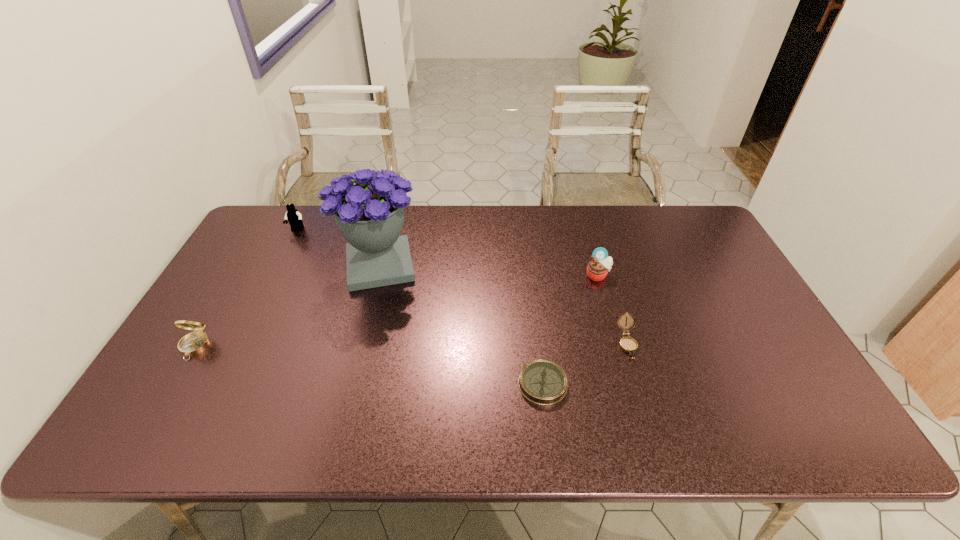
The height and width of the screenshot is (540, 960). I want to click on the third object from right to left, so click(543, 382).

Locate an element on the screen. free point located on the front of the bouquet is located at coordinates (365, 324).

Where is `free location located on the front-facing side of the second object from left to right`? This screenshot has height=540, width=960. free location located on the front-facing side of the second object from left to right is located at coordinates (255, 314).

Find the location of a particular element. vacant position located on the front-facing side of the muffin is located at coordinates (631, 390).

You are a GUI agent. You are given a task and a screenshot of the screen. Output one action in this format:
    pyautogui.click(x=<x>, y=<y>)
    Task: Click on the vacant space located 0.070m with the dial facing the leftmost compass
    This screenshot has height=540, width=960.
    Given the screenshot: What is the action you would take?
    pyautogui.click(x=172, y=384)

This screenshot has height=540, width=960. What are the coordinates of `free spot located on the face of the fifth tallest object` in the screenshot? It's located at (657, 440).

The height and width of the screenshot is (540, 960). Identify the location of vacant space located on the back of the nearest compass. (535, 319).

This screenshot has width=960, height=540. In order to click on bouquet at the far edge in this screenshot , I will do `click(370, 213)`.

Image resolution: width=960 pixels, height=540 pixels. Find the location of `Lego that is at the far edge`. Lego that is at the far edge is located at coordinates (294, 218).

Locate an element on the screen. The image size is (960, 540). Lego present at the left edge is located at coordinates (294, 218).